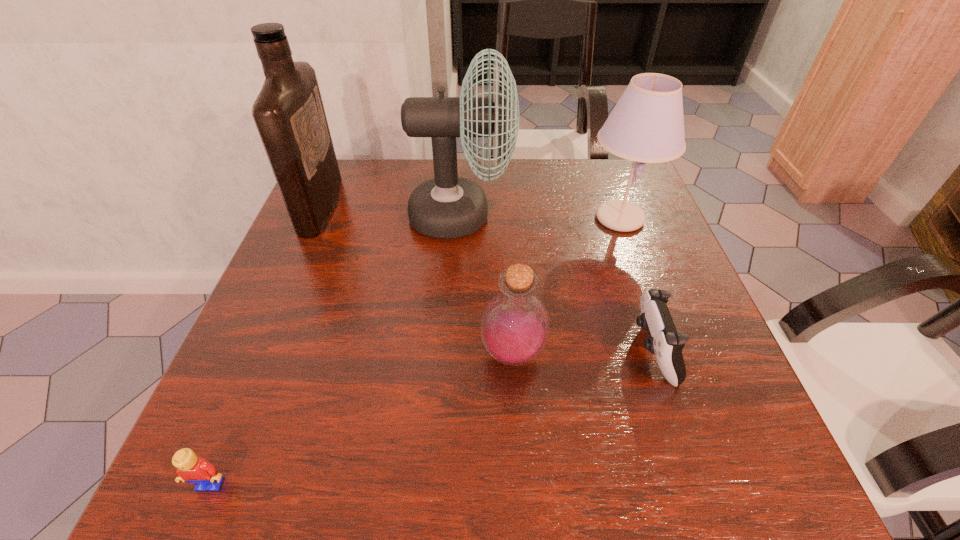
The width and height of the screenshot is (960, 540). I want to click on liquor, so click(289, 114).

Locate an element on the screen. This screenshot has height=540, width=960. fan is located at coordinates (447, 206).

At what (x,y) coordinates should I click in order to perform the action: click on the fourth shortest object. Please return your answer as a coordinate pair (x, y). The image size is (960, 540). Looking at the image, I should click on (647, 124).

The height and width of the screenshot is (540, 960). Identify the location of the third shortest object. (515, 326).

Identify the location of control. This screenshot has width=960, height=540. (664, 341).

Image resolution: width=960 pixels, height=540 pixels. Identify the location of Lego. (189, 468).

I want to click on blank space located 0.270m on the label side of the liquor, so click(x=445, y=206).

The width and height of the screenshot is (960, 540). In order to click on vacant space located in front of the fan where the airflow is directed in this screenshot , I will do `click(534, 216)`.

Identify the location of vacant region located 0.070m on the left of the third tallest object. (553, 218).

Where is `vacant space located on the left of the bottle`? vacant space located on the left of the bottle is located at coordinates (300, 354).